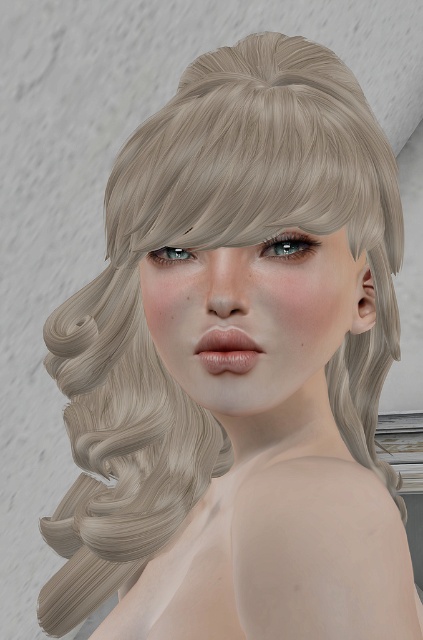
Based on the scene description, which object occupies more visual space in the image? Please consider the size mentioned in the description between the sleek blonde hair at center and the satin blue eye at upper center.

The sleek blonde hair at center occupies more visual space because it has a larger size compared to the satin blue eye at upper center according to the description.

You are a photographer adjusting the focus on a camera. You want to ensure that both the sleek blonde hair at center and the satin blue eye at upper center are in sharp focus. Given their positions, which object should you focus on first to achieve this?

You should focus on the sleek blonde hair at center first because it is closer to the viewer than the satin blue eye at upper center. By focusing on the closer object, the depth of field may extend to include the farther object in acceptable focus.

You are a makeup artist preparing to apply eyeliner to the satin blue eye at center. The sleek blonde hair at center is in the way. Can you lift the hair out of the way without moving the person? Explain how.

The sleek blonde hair at center is located above the satin blue eye at center. You can gently lift the sleek blonde hair at center using a hair clip or your fingers to move it out of the way without disturbing the person.